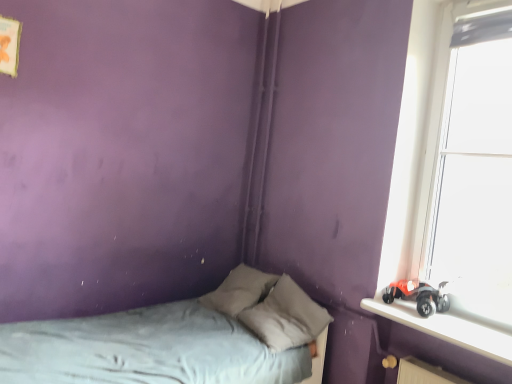
Question: Is transparent glass window at right facing away from gray fabric pillow at center?

Choices:
 (A) no
 (B) yes

Answer: (A)

Question: Considering the relative sizes of transparent glass window at right and gray fabric pillow at center in the image provided, is transparent glass window at right thinner than gray fabric pillow at center?

Choices:
 (A) no
 (B) yes

Answer: (B)

Question: Does transparent glass window at right have a lesser height compared to gray fabric pillow at center?

Choices:
 (A) yes
 (B) no

Answer: (B)

Question: Is transparent glass window at right bigger than gray fabric pillow at center?

Choices:
 (A) no
 (B) yes

Answer: (B)

Question: Is transparent glass window at right taller than gray fabric pillow at center?

Choices:
 (A) yes
 (B) no

Answer: (A)

Question: From a real-world perspective, is transparent glass window at right positioned over gray fabric pillow at center based on gravity?

Choices:
 (A) no
 (B) yes

Answer: (B)

Question: Would you consider smooth plastic toy car at right to be distant from transparent glass window at right?

Choices:
 (A) yes
 (B) no

Answer: (B)

Question: Does smooth plastic toy car at right have a greater height compared to transparent glass window at right?

Choices:
 (A) no
 (B) yes

Answer: (A)

Question: Considering the relative positions of smooth plastic toy car at right and transparent glass window at right in the image provided, is smooth plastic toy car at right behind transparent glass window at right?

Choices:
 (A) no
 (B) yes

Answer: (A)

Question: Would you say smooth plastic toy car at right contains transparent glass window at right?

Choices:
 (A) no
 (B) yes

Answer: (A)

Question: Does smooth plastic toy car at right have a larger size compared to transparent glass window at right?

Choices:
 (A) no
 (B) yes

Answer: (A)

Question: Is smooth plastic toy car at right aimed at transparent glass window at right?

Choices:
 (A) yes
 (B) no

Answer: (B)

Question: Considering the relative positions of transparent glass window at right and gray fabric bed at lower left in the image provided, is transparent glass window at right to the right of gray fabric bed at lower left from the viewer's perspective?

Choices:
 (A) yes
 (B) no

Answer: (A)